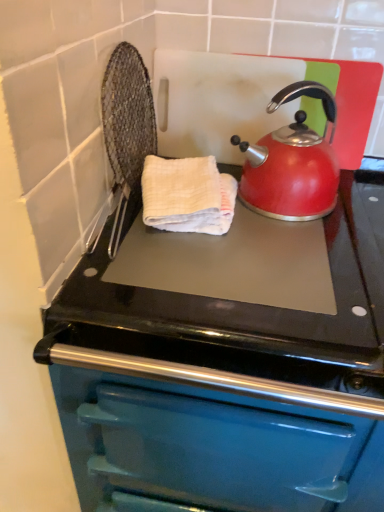
Question: Is teal enamel oven at center directly adjacent to shiny red kettle at upper right?

Choices:
 (A) yes
 (B) no

Answer: (B)

Question: Can you confirm if teal enamel oven at center is taller than shiny red kettle at upper right?

Choices:
 (A) yes
 (B) no

Answer: (A)

Question: Does teal enamel oven at center have a greater width compared to shiny red kettle at upper right?

Choices:
 (A) no
 (B) yes

Answer: (B)

Question: Does teal enamel oven at center have a lesser height compared to shiny red kettle at upper right?

Choices:
 (A) no
 (B) yes

Answer: (A)

Question: From the image's perspective, is teal enamel oven at center located beneath shiny red kettle at upper right?

Choices:
 (A) yes
 (B) no

Answer: (A)

Question: Can you confirm if teal enamel oven at center is smaller than shiny red kettle at upper right?

Choices:
 (A) yes
 (B) no

Answer: (B)

Question: Is white textured hand towel at center completely or partially outside of teal enamel oven at center?

Choices:
 (A) no
 (B) yes

Answer: (B)

Question: Is white textured hand towel at center surrounding teal enamel oven at center?

Choices:
 (A) yes
 (B) no

Answer: (B)

Question: From a real-world perspective, is white textured hand towel at center positioned under teal enamel oven at center based on gravity?

Choices:
 (A) no
 (B) yes

Answer: (A)

Question: Is white textured hand towel at center thinner than teal enamel oven at center?

Choices:
 (A) yes
 (B) no

Answer: (A)

Question: Is white textured hand towel at center aimed at teal enamel oven at center?

Choices:
 (A) no
 (B) yes

Answer: (A)

Question: Does white textured hand towel at center appear on the left side of teal enamel oven at center?

Choices:
 (A) no
 (B) yes

Answer: (B)

Question: Is the surface of shiny red kettle at upper right in direct contact with teal enamel oven at center?

Choices:
 (A) no
 (B) yes

Answer: (A)